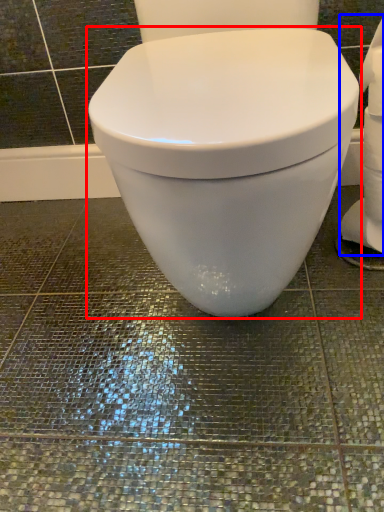
Question: Which object appears farthest to the camera in this image, toilet (highlighted by a red box) or toilet paper (highlighted by a blue box)?

Choices:
 (A) toilet
 (B) toilet paper

Answer: (B)